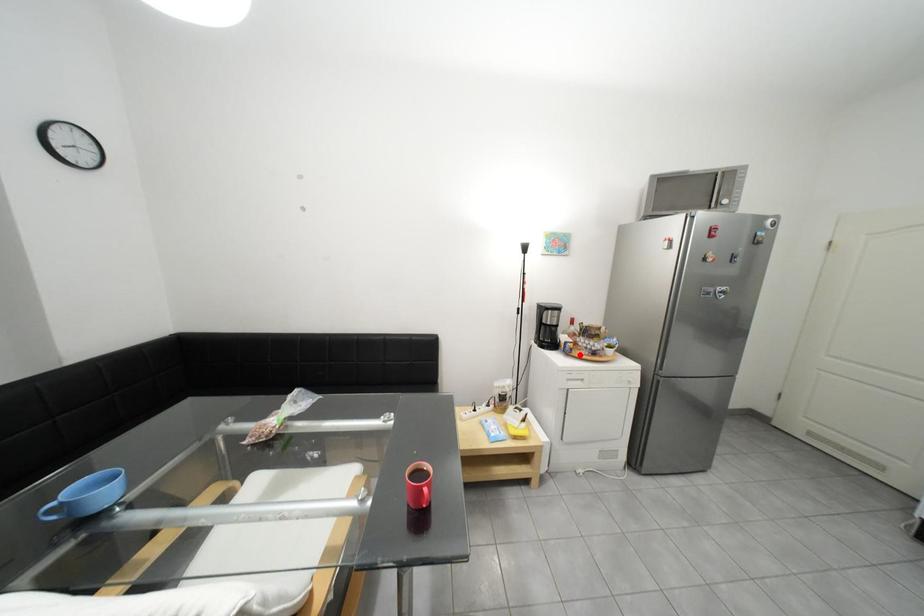
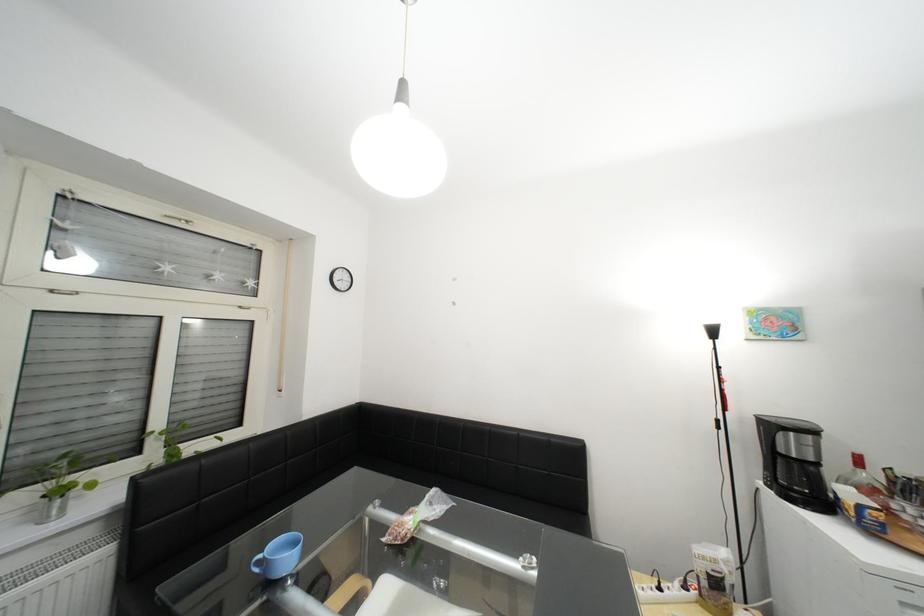
The point at the highlighted location is marked in the first image. Where is the corresponding point in the second image?

(886, 533)